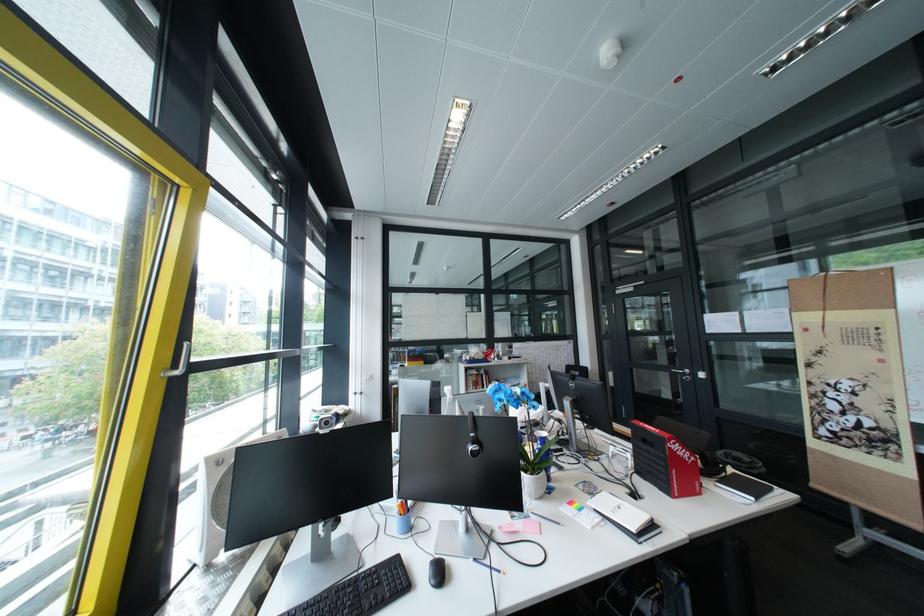
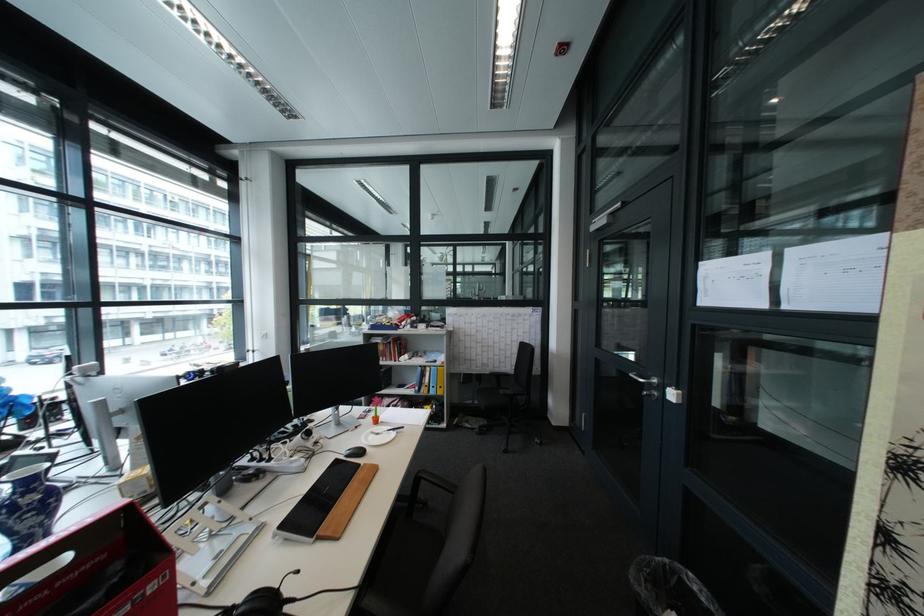
In a continuous first-person perspective shot, in which direction is the camera moving?

The movement direction of the cameraman is right, forward.